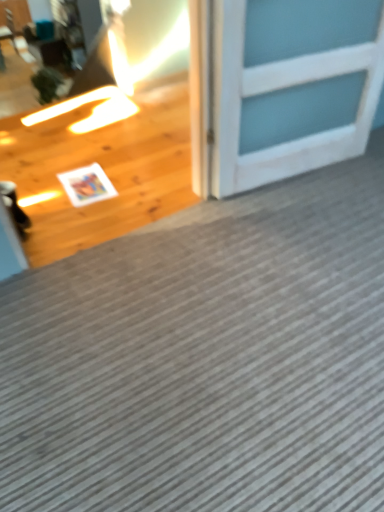
The width and height of the screenshot is (384, 512). Describe the element at coordinates (206, 358) in the screenshot. I see `gray textured mat at center` at that location.

I want to click on gray textured mat at center, so (206, 358).

This screenshot has height=512, width=384. I want to click on white wooden door at upper right, so click(x=291, y=88).

In order to face white wooden door at upper right, should I rotate leftwards or rightwards?

To align with it, rotate right about 14.756°.

Describe the element at coordinates (291, 88) in the screenshot. The height and width of the screenshot is (512, 384). I see `white wooden door at upper right` at that location.

Where is `gray textured mat at center`? Image resolution: width=384 pixels, height=512 pixels. gray textured mat at center is located at coordinates (206, 358).

Based on the photo, is white wooden door at upper right at the right side of gray textured mat at center?

Indeed, white wooden door at upper right is positioned on the right side of gray textured mat at center.

Is the position of white wooden door at upper right less distant than that of gray textured mat at center?

No, white wooden door at upper right is further to the viewer.

Which is nearer, [304,85] or [370,245]?

Positioned in front is point [370,245].

From the image's perspective, which is below, white wooden door at upper right or gray textured mat at center?

gray textured mat at center.

From a real-world perspective, is white wooden door at upper right physically located above or below gray textured mat at center?

From a real-world perspective, white wooden door at upper right is physically above gray textured mat at center.

Is white wooden door at upper right wider or thinner than gray textured mat at center?

Considering their sizes, white wooden door at upper right looks slimmer than gray textured mat at center.

From the picture: Considering the relative sizes of white wooden door at upper right and gray textured mat at center in the image provided, is white wooden door at upper right taller than gray textured mat at center?

Correct, white wooden door at upper right is much taller as gray textured mat at center.

Looking at this image, based on their sizes in the image, would you say white wooden door at upper right is bigger or smaller than gray textured mat at center?

Considering their sizes, white wooden door at upper right takes up less space than gray textured mat at center.

Would you say white wooden door at upper right is inside or outside gray textured mat at center?

white wooden door at upper right is outside gray textured mat at center.

Is there a large distance between white wooden door at upper right and gray textured mat at center?

white wooden door at upper right is near gray textured mat at center, not far away.

Is white wooden door at upper right turned away from gray textured mat at center?

No, white wooden door at upper right's orientation is not away from gray textured mat at center.

What's the angular difference between white wooden door at upper right and gray textured mat at center's facing directions?

There is a 173-degree angle between the facing directions of white wooden door at upper right and gray textured mat at center.

How distant is white wooden door at upper right from gray textured mat at center?

28.72 inches.

You are a GUI agent. You are given a task and a screenshot of the screen. Output one action in this format:
    pyautogui.click(x=<x>, y=<y>)
    Task: Click on the doormat on the left of the white wooden door at upper right
    The width and height of the screenshot is (384, 512).
    Given the screenshot: What is the action you would take?
    pyautogui.click(x=206, y=358)

Which is more to the right, gray textured mat at center or white wooden door at upper right?

From the viewer's perspective, white wooden door at upper right appears more on the right side.

From the picture: Which is behind, gray textured mat at center or white wooden door at upper right?

white wooden door at upper right is further away from the camera.

Which point is more distant from viewer, (215, 261) or (264, 84)?

Positioned behind is point (215, 261).

From the image's perspective, between gray textured mat at center and white wooden door at upper right, who is located below?

gray textured mat at center is shown below in the image.

From a real-world perspective, which is physically below, gray textured mat at center or white wooden door at upper right?

gray textured mat at center.

Which of these two, gray textured mat at center or white wooden door at upper right, is thinner?

white wooden door at upper right.

From the picture: Is gray textured mat at center taller than white wooden door at upper right?

No, gray textured mat at center is not taller than white wooden door at upper right.

Between gray textured mat at center and white wooden door at upper right, which one has larger size?

Bigger between the two is gray textured mat at center.

Would you say gray textured mat at center contains white wooden door at upper right?

No.

Are gray textured mat at center and white wooden door at upper right far apart?

No, there isn't a large distance between gray textured mat at center and white wooden door at upper right.

Is gray textured mat at center turned away from white wooden door at upper right?

gray textured mat at center does not have its back to white wooden door at upper right.

I want to click on doormat located in front of the white wooden door at upper right, so click(206, 358).

Image resolution: width=384 pixels, height=512 pixels. Find the location of `door behind the gray textured mat at center`. door behind the gray textured mat at center is located at coordinates (291, 88).

Identify the location of door above the gray textured mat at center (from the image's perspective). This screenshot has height=512, width=384. (291, 88).